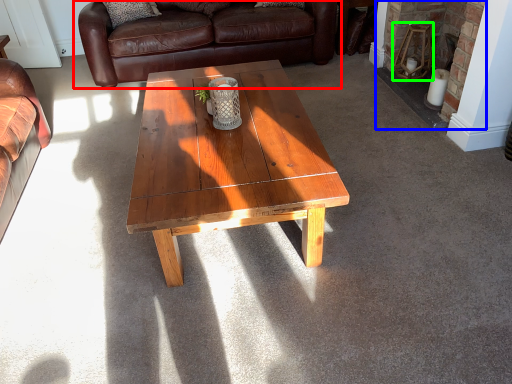
Question: Which object is positioned farthest from studio couch (highlighted by a red box)? Select from fireplace (highlighted by a blue box) and stool (highlighted by a green box).

Choices:
 (A) fireplace
 (B) stool

Answer: (B)